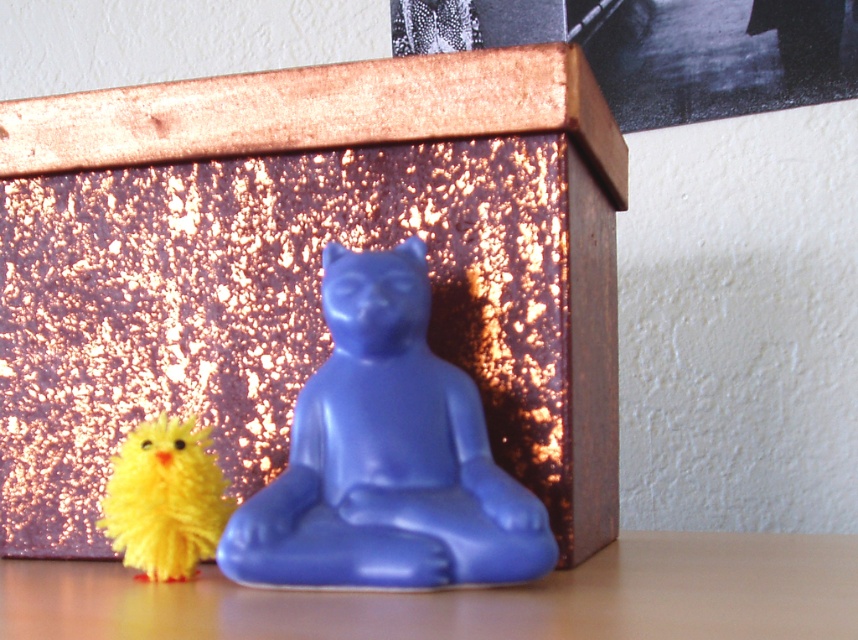
You are organizing a display on a narrow shelf that can only accommodate items up to 12 inches in width. You have the metallic gold box at center and the matte blue statue at center. Based on their widths, which item is more likely to fit within the shelf space?

The matte blue statue at center is more likely to fit within the shelf space since the metallic gold box at center is wider than it.

You are arranging items on a table and see the matte blue statue at center and the matte wood table at lower center. Which object is positioned higher in the scene?

The matte blue statue at center is above the matte wood table at lower center, so it is positioned higher in the scene.